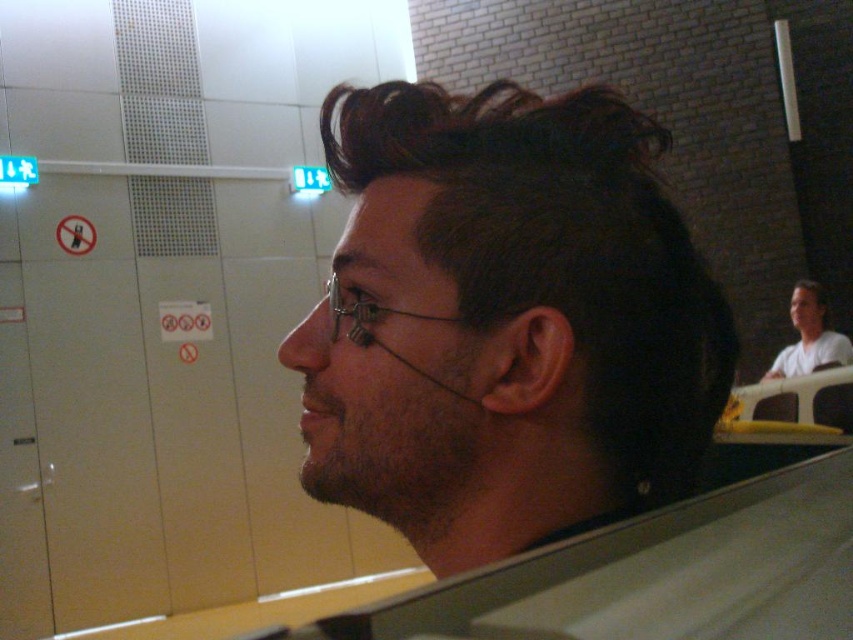
Question: Does white matte shirt at upper right have a smaller size compared to clear plastic glasses at center?

Choices:
 (A) yes
 (B) no

Answer: (B)

Question: Is the position of white matte shirt at upper right more distant than that of clear plastic glasses at center?

Choices:
 (A) no
 (B) yes

Answer: (B)

Question: Which object is positioned farthest from the clear plastic glasses at center?

Choices:
 (A) white matte shirt at upper right
 (B) dark brown hair at center

Answer: (A)

Question: Which point appears farthest from the camera in this image?

Choices:
 (A) (695, 305)
 (B) (807, 353)

Answer: (B)

Question: Which object is farther from the camera taking this photo?

Choices:
 (A) dark brown hair at center
 (B) clear plastic glasses at center

Answer: (B)

Question: Is white matte shirt at upper right bigger than clear plastic glasses at center?

Choices:
 (A) yes
 (B) no

Answer: (A)